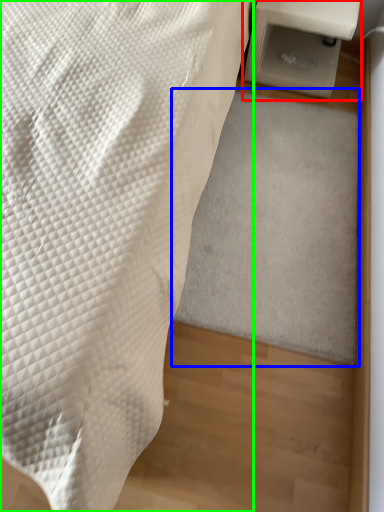
Question: Considering the real-world distances, which object is closest to table (highlighted by a red box)? mat (highlighted by a blue box) or furniture (highlighted by a green box).

Choices:
 (A) mat
 (B) furniture

Answer: (A)